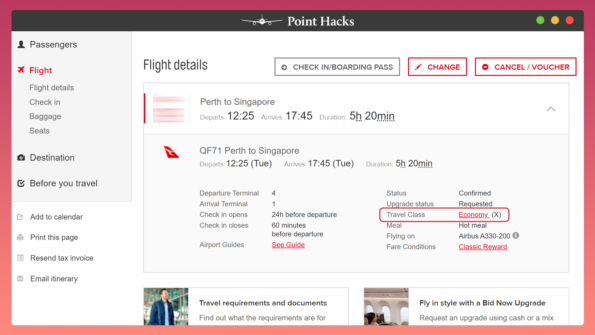
Identify the location of photographs. The height and width of the screenshot is (335, 595). (161, 300), (393, 296).